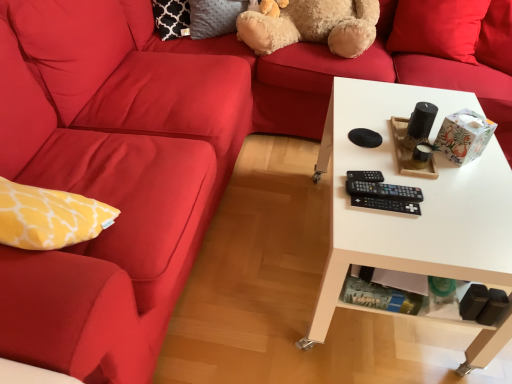
Question: Should I look upward or downward to see red matte pillow at upper right?

Choices:
 (A) up
 (B) down

Answer: (A)

Question: Is black plastic remote at center, which is the second control from front to back, to the left of black plastic remote at center, the 1th control when ordered from front to back, from the viewer's perspective?

Choices:
 (A) no
 (B) yes

Answer: (A)

Question: Can you confirm if black plastic remote at center, which ranks as the 2th control in back-to-front order, is thinner than black plastic remote at center, which appears as the 3th control when viewed from the back?

Choices:
 (A) yes
 (B) no

Answer: (B)

Question: Does black plastic remote at center, which is the second control from front to back, have a larger size compared to black plastic remote at center, which appears as the 3th control when viewed from the back?

Choices:
 (A) yes
 (B) no

Answer: (A)

Question: From the image's perspective, is black plastic remote at center, which is the second control from front to back, below black plastic remote at center, the 1th control when ordered from front to back?

Choices:
 (A) no
 (B) yes

Answer: (A)

Question: From a real-world perspective, is black plastic remote at center, which ranks as the 2th control in back-to-front order, beneath black plastic remote at center, which appears as the 3th control when viewed from the back?

Choices:
 (A) yes
 (B) no

Answer: (B)

Question: Could you tell me if black plastic remote at center, which ranks as the 2th control in back-to-front order, is facing black plastic remote at center, the 1th control when ordered from front to back?

Choices:
 (A) no
 (B) yes

Answer: (A)

Question: From a real-world perspective, does black plastic remote at center, the first control from the back, sit lower than fuzzy beige teddy bear at upper center?

Choices:
 (A) no
 (B) yes

Answer: (B)

Question: From a real-world perspective, is black plastic remote at center, the first control from the back, over fuzzy beige teddy bear at upper center?

Choices:
 (A) no
 (B) yes

Answer: (A)

Question: Can you confirm if black plastic remote at center, placed as the third control when sorted from front to back, is shorter than fuzzy beige teddy bear at upper center?

Choices:
 (A) yes
 (B) no

Answer: (A)

Question: From the image's perspective, does black plastic remote at center, placed as the third control when sorted from front to back, appear lower than fuzzy beige teddy bear at upper center?

Choices:
 (A) yes
 (B) no

Answer: (A)

Question: From the image's perspective, is black plastic remote at center, the first control from the back, over fuzzy beige teddy bear at upper center?

Choices:
 (A) no
 (B) yes

Answer: (A)

Question: Is black plastic remote at center, the first control from the back, next to fuzzy beige teddy bear at upper center and touching it?

Choices:
 (A) yes
 (B) no

Answer: (B)

Question: Is black plastic remote at center, which is the second control from front to back, not near red matte pillow at upper right?

Choices:
 (A) no
 (B) yes

Answer: (B)